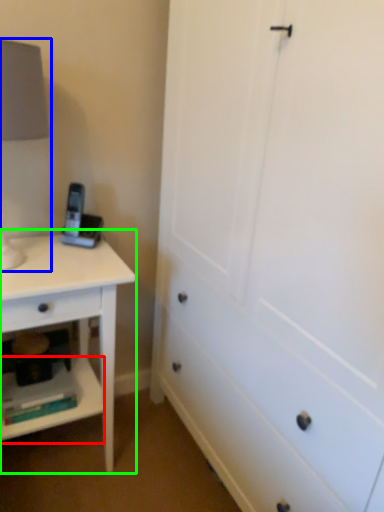
Question: Which object is the farthest from shelf (highlighted by a red box)? Choose among these: table lamp (highlighted by a blue box) or nightstand (highlighted by a green box).

Choices:
 (A) table lamp
 (B) nightstand

Answer: (A)